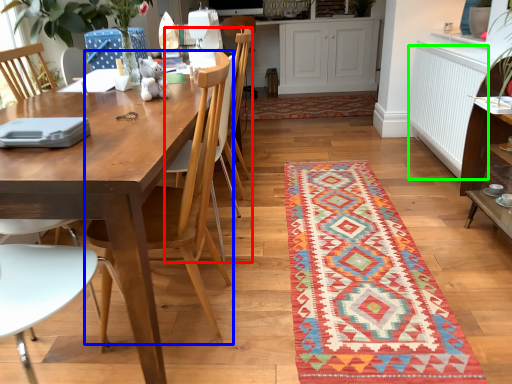
Question: Which is farther away from armchair (highlighted by a red box)? chair (highlighted by a blue box) or radiator (highlighted by a green box)?

Choices:
 (A) chair
 (B) radiator

Answer: (B)